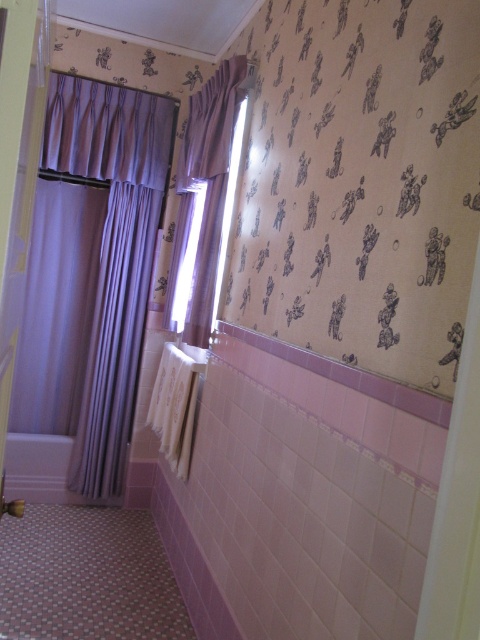
Does point (105, 164) come behind point (226, 154)?

Yes, it is behind point (226, 154).

Is point (108, 324) in front of point (168, 276)?

Yes, it is in front of point (168, 276).

Image resolution: width=480 pixels, height=640 pixels. What are the coordinates of `purple fabric shower curtain at left` in the screenshot? It's located at (111, 253).

You are a GUI agent. You are given a task and a screenshot of the screen. Output one action in this format:
    pyautogui.click(x=<x>, y=<y>)
    Task: Click on the purple fabric shower curtain at left
    The width and height of the screenshot is (480, 640).
    Given the screenshot: What is the action you would take?
    pyautogui.click(x=111, y=253)